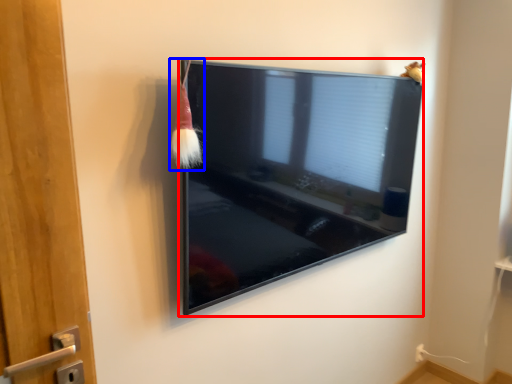
Question: Which object appears closest to the camera in this image, television (highlighted by a red box) or brush (highlighted by a blue box)?

Choices:
 (A) television
 (B) brush

Answer: (B)